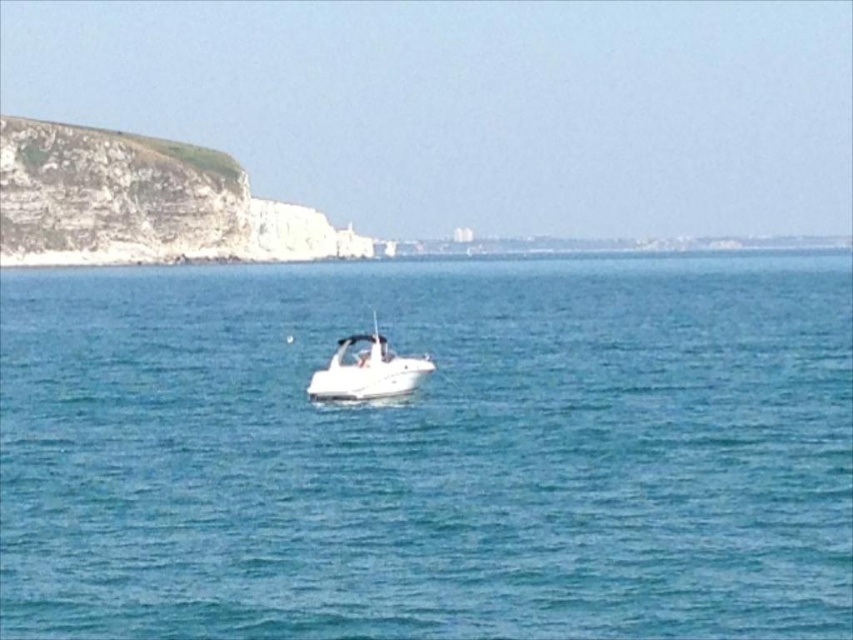
You are a photographer planning to capture the entire scene of the clear blue water at center and the white rocky cliff at upper left in one shot. Based on their sizes, which object would occupy more of the frame?

The clear blue water at center occupies more of the frame because it is larger in size than the white rocky cliff at upper left.

You are standing at the point closer to the camera in this coastal scene. Which point are you at, point (x=167, y=196) or point (x=384, y=349)?

You are at point (x=167, y=196) because it is further to the camera than point (x=384, y=349).

Consider the image. You are a photographer planning to capture the white glossy boat at center and the clear blue water at center in a single shot. Based on their positions, which one will appear closer to the camera in the photo?

The clear blue water at center appears closer to the camera because it is positioned over the white glossy boat at center, indicating it is layered in front of the boat in the image.